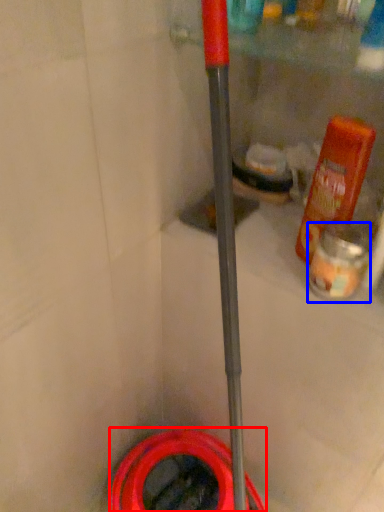
Question: Which object is closer to the camera taking this photo, garden hose (highlighted by a red box) or cleaning product (highlighted by a blue box)?

Choices:
 (A) garden hose
 (B) cleaning product

Answer: (B)